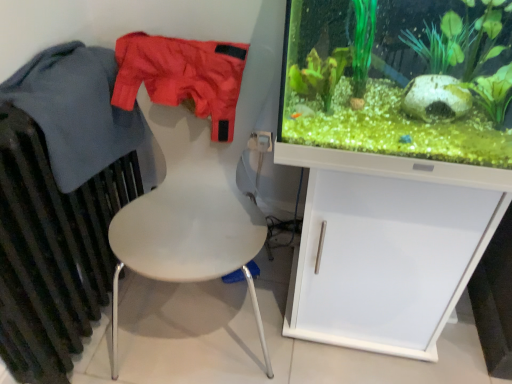
At what (x,y) coordinates should I click in order to perform the action: click on vacant region below white plastic chair at center (from a real-world perspective). Please return your answer as a coordinate pair (x, y). Looking at the image, I should click on (207, 314).